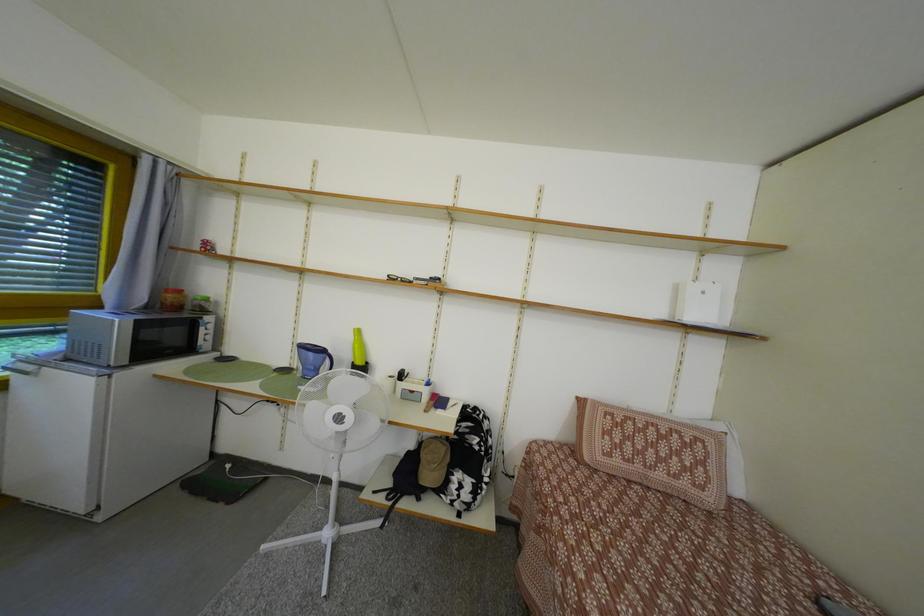
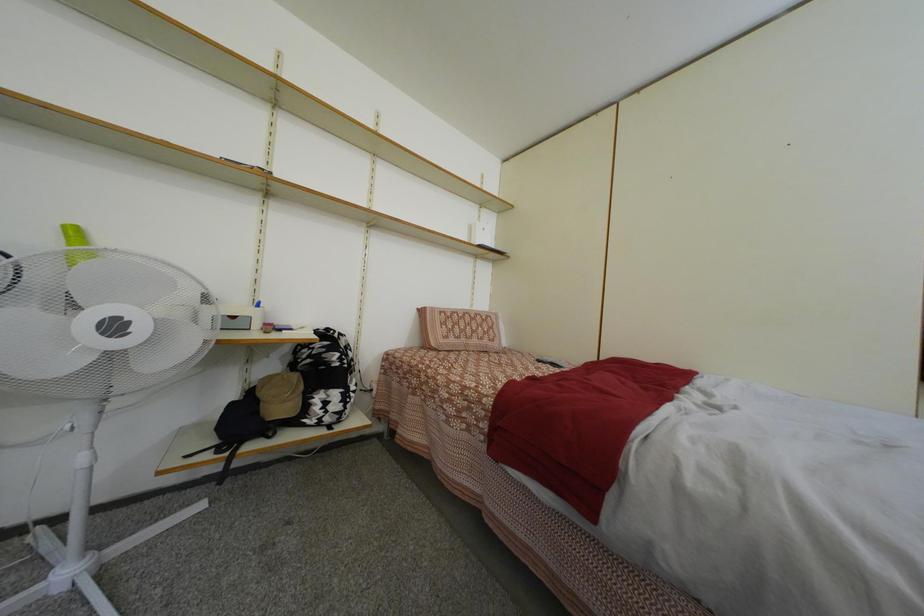
Question: The camera is either moving clockwise (left) or counter-clockwise (right) around the object. The first image is from the beginning of the video and the second image is from the end. Is the camera moving left or right when shooting the video?

Choices:
 (A) Left
 (B) Right

Answer: (A)